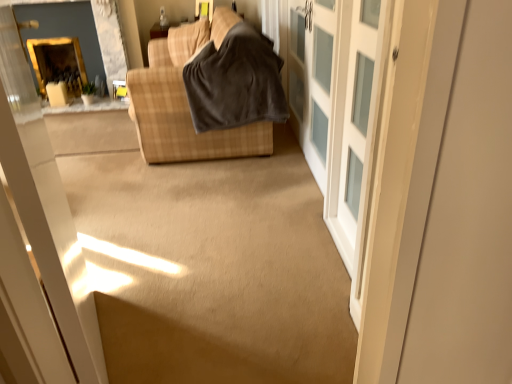
This screenshot has height=384, width=512. What do you see at coordinates (335, 102) in the screenshot? I see `white frosted glass barn door at center` at bounding box center [335, 102].

Identify the location of brown plaid fabric couch at upper center. The width and height of the screenshot is (512, 384). (185, 102).

What do you see at coordinates (234, 82) in the screenshot?
I see `dark gray fleece blanket at center` at bounding box center [234, 82].

In the scene shown: Measure the distance between white frosted glass cabinet at right and camera.

The distance of white frosted glass cabinet at right from camera is 1.90 meters.

The image size is (512, 384). What are the coordinates of `gold-framed mirror at upper left` in the screenshot? It's located at (58, 63).

Can you confirm if gold-framed mirror at upper left is positioned to the left of white frosted glass cabinet at right?

Yes.

Identify the location of fireplace that is under the white frosted glass cabinet at right (from a real-world perspective). (58, 63).

Is gold-framed mirror at upper left inside the boundaries of white frosted glass cabinet at right, or outside?

gold-framed mirror at upper left is not enclosed by white frosted glass cabinet at right.

Does gold-framed mirror at upper left have a larger size compared to white frosted glass cabinet at right?

Correct, gold-framed mirror at upper left is larger in size than white frosted glass cabinet at right.

Is dark gray fleece blanket at center next to matte yellow window at upper center and touching it?

dark gray fleece blanket at center is not next to matte yellow window at upper center, and they're not touching.

Relative to matte yellow window at upper center, is dark gray fleece blanket at center in front or behind?

Clearly, dark gray fleece blanket at center is in front of matte yellow window at upper center.

How different are the orientations of dark gray fleece blanket at center and matte yellow window at upper center in degrees?

They differ by 66 degrees in their facing directions.

From the image's perspective, is dark gray fleece blanket at center below matte yellow window at upper center?

Yes, from the image's perspective, dark gray fleece blanket at center is below matte yellow window at upper center.

Which is closer to the camera, (366, 177) or (277, 109)?

Point (366, 177).

Who is taller, white frosted glass barn door at center or dark gray fleece blanket at center?

white frosted glass barn door at center.

Who is bigger, white frosted glass barn door at center or dark gray fleece blanket at center?

Bigger between the two is white frosted glass barn door at center.

Looking at this image, is white frosted glass barn door at center in front of or behind dark gray fleece blanket at center in the image?

Visually, white frosted glass barn door at center is located in front of dark gray fleece blanket at center.

Based on their sizes in the image, would you say white frosted glass cabinet at right is bigger or smaller than matte yellow window at upper center?

Considering their sizes, white frosted glass cabinet at right takes up more space than matte yellow window at upper center.

Image resolution: width=512 pixels, height=384 pixels. I want to click on screen door that appears below the matte yellow window at upper center (from a real-world perspective), so click(x=312, y=78).

Which object is closer to the camera, white frosted glass cabinet at right or matte yellow window at upper center?

Positioned in front is white frosted glass cabinet at right.

From the picture: Is matte yellow window at upper center at the back of white frosted glass cabinet at right?

white frosted glass cabinet at right does not have its back to matte yellow window at upper center.

Considering the sizes of white frosted glass barn door at center and white frosted glass cabinet at right in the image, is white frosted glass barn door at center bigger or smaller than white frosted glass cabinet at right?

In the image, white frosted glass barn door at center appears to be larger than white frosted glass cabinet at right.

How different are the orientations of white frosted glass barn door at center and white frosted glass cabinet at right in degrees?

white frosted glass barn door at center and white frosted glass cabinet at right are facing 0.0509 degrees away from each other.

From a real-world perspective, is white frosted glass barn door at center below white frosted glass cabinet at right?

No, from a real-world perspective, white frosted glass barn door at center is not under white frosted glass cabinet at right.

Would you say brown plaid fabric couch at upper center is inside or outside gold-framed mirror at upper left?

brown plaid fabric couch at upper center lies outside gold-framed mirror at upper left.

The height and width of the screenshot is (384, 512). I want to click on studio couch on the right of the gold-framed mirror at upper left, so click(185, 102).

Is the depth of brown plaid fabric couch at upper center less than that of gold-framed mirror at upper left?

That is True.

Can you confirm if brown plaid fabric couch at upper center is positioned to the left of gold-framed mirror at upper left?

No, brown plaid fabric couch at upper center is not to the left of gold-framed mirror at upper left.

Based on the photo, between gold-framed mirror at upper left and dark gray fleece blanket at center, which one has more height?

With more height is dark gray fleece blanket at center.

Which of these two, gold-framed mirror at upper left or dark gray fleece blanket at center, is smaller?

gold-framed mirror at upper left.

Looking at their sizes, would you say gold-framed mirror at upper left is wider or thinner than dark gray fleece blanket at center?

Clearly, gold-framed mirror at upper left has less width compared to dark gray fleece blanket at center.

The width and height of the screenshot is (512, 384). Identify the location of fireplace above the white frosted glass cabinet at right (from the image's perspective). (58, 63).

This screenshot has width=512, height=384. In the image, there is a matte yellow window at upper center. In order to click on blanket below it (from the image's perspective) in this screenshot , I will do `click(234, 82)`.

Based on their spatial positions, is matte yellow window at upper center or brown plaid fabric couch at upper center further from gold-framed mirror at upper left?

brown plaid fabric couch at upper center is positioned further to the anchor gold-framed mirror at upper left.

When comparing their distances from brown plaid fabric couch at upper center, does white frosted glass cabinet at right or gold-framed mirror at upper left seem further?

gold-framed mirror at upper left lies further to brown plaid fabric couch at upper center than the other object.

Considering their positions, is white frosted glass barn door at center positioned further to matte yellow window at upper center than dark gray fleece blanket at center?

Based on the image, white frosted glass barn door at center appears to be further to matte yellow window at upper center.

When comparing their distances from white frosted glass barn door at center, does brown plaid fabric couch at upper center or white frosted glass cabinet at right seem closer?

Among the two, white frosted glass cabinet at right is located nearer to white frosted glass barn door at center.

Based on their spatial positions, is brown plaid fabric couch at upper center or gold-framed mirror at upper left further from dark gray fleece blanket at center?

The object further to dark gray fleece blanket at center is gold-framed mirror at upper left.

From the image, which object appears to be nearer to white frosted glass barn door at center, white frosted glass cabinet at right or dark gray fleece blanket at center?

white frosted glass cabinet at right is closer to white frosted glass barn door at center.

Estimate the real-world distances between objects in this image. Which object is further from dark gray fleece blanket at center, matte yellow window at upper center or white frosted glass barn door at center?

matte yellow window at upper center lies further to dark gray fleece blanket at center than the other object.

From the image, which object appears to be nearer to white frosted glass cabinet at right, gold-framed mirror at upper left or white frosted glass barn door at center?

white frosted glass barn door at center.

You are a GUI agent. You are given a task and a screenshot of the screen. Output one action in this format:
    pyautogui.click(x=<x>, y=<y>)
    Task: Click on the screen door positioned between white frosted glass barn door at center and gold-framed mirror at upper left from near to far
    
    Given the screenshot: What is the action you would take?
    [312, 78]

This screenshot has height=384, width=512. Find the location of `blanket located between white frosted glass cabinet at right and matte yellow window at upper center in the depth direction`. blanket located between white frosted glass cabinet at right and matte yellow window at upper center in the depth direction is located at coordinates (234, 82).

You are a GUI agent. You are given a task and a screenshot of the screen. Output one action in this format:
    pyautogui.click(x=<x>, y=<y>)
    Task: Click on the studio couch located between white frosted glass barn door at center and gold-framed mirror at upper left in the depth direction
    
    Given the screenshot: What is the action you would take?
    pyautogui.click(x=185, y=102)

Image resolution: width=512 pixels, height=384 pixels. Find the location of `studio couch positioned between white frosted glass cabinet at right and matte yellow window at upper center from near to far`. studio couch positioned between white frosted glass cabinet at right and matte yellow window at upper center from near to far is located at coordinates point(185,102).